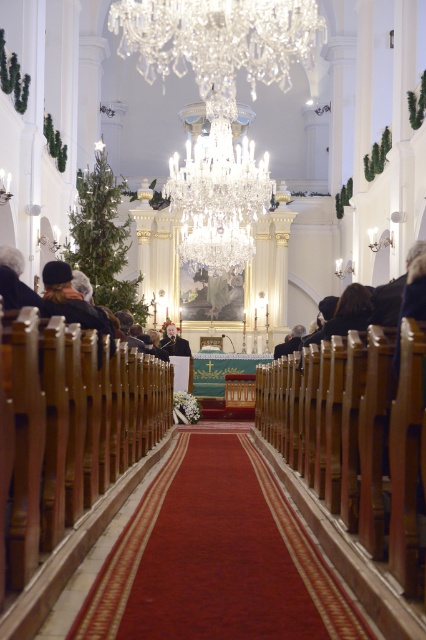
Question: Is crystal glass chandelier at upper center wider than dark brown leather jacket at left?

Choices:
 (A) yes
 (B) no

Answer: (A)

Question: Among these objects, which one is nearest to the camera?

Choices:
 (A) dark brown leather jacket at left
 (B) smooth black jacket at center

Answer: (A)

Question: Does crystal glass chandelier at upper center have a lesser width compared to dark brown leather jacket at left?

Choices:
 (A) yes
 (B) no

Answer: (B)

Question: Which of the following is the farthest from the observer?

Choices:
 (A) smooth black jacket at center
 (B) crystal glass chandelier at upper center

Answer: (A)

Question: Can you confirm if crystal glass chandelier at upper center is positioned above dark brown leather jacket at left?

Choices:
 (A) yes
 (B) no

Answer: (A)

Question: Based on their relative distances, which object is farther from the dark brown leather jacket at left?

Choices:
 (A) carpeted aisle at center
 (B) crystal glass chandelier at upper center
 (C) smooth black jacket at center

Answer: (C)